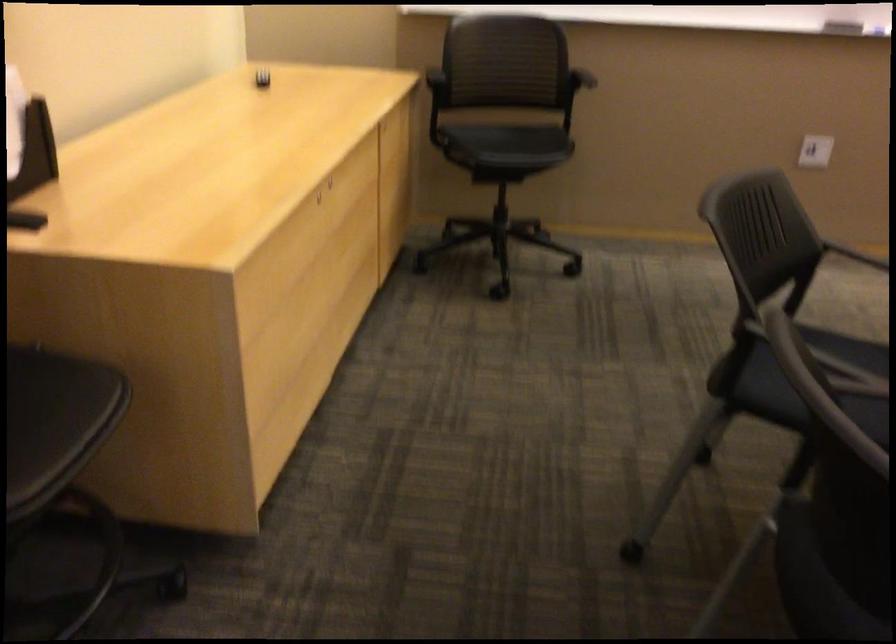
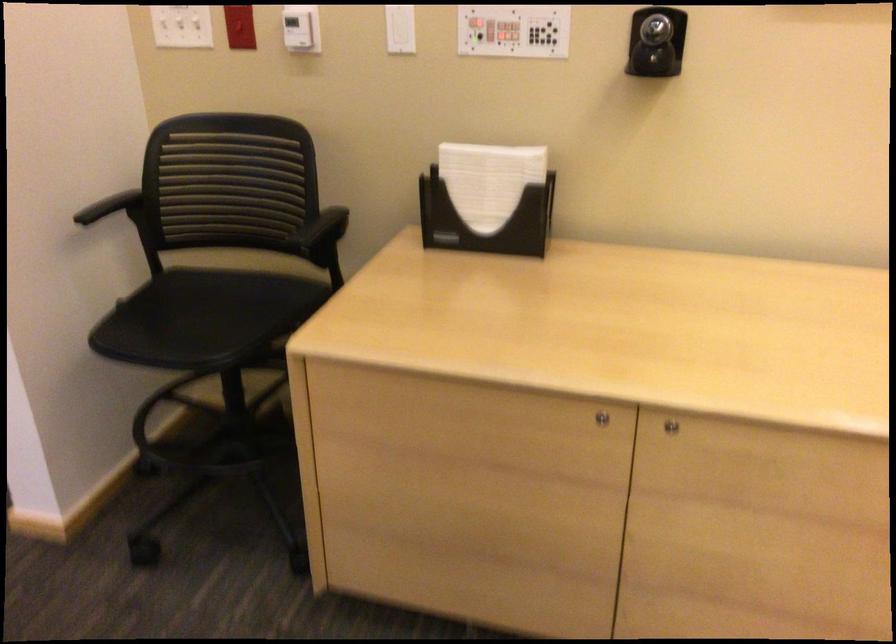
Where in the second image is the point corresponding to the point at 347,207 from the first image?

(670, 426)